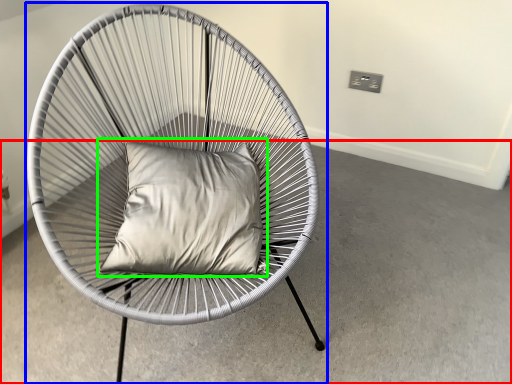
Question: Which is nearer to the concrete (highlighted by a red box)? chair (highlighted by a blue box) or pillow (highlighted by a green box).

Choices:
 (A) chair
 (B) pillow

Answer: (B)